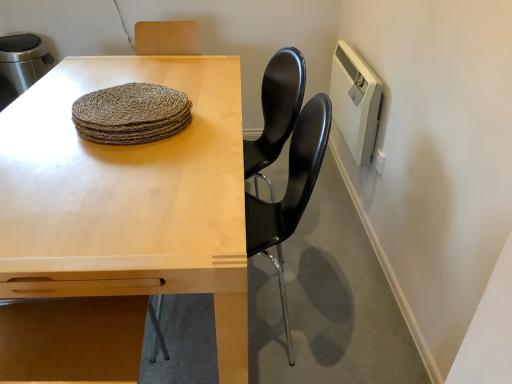
The height and width of the screenshot is (384, 512). I want to click on vacant space behind natural woven placemat at center, so click(175, 86).